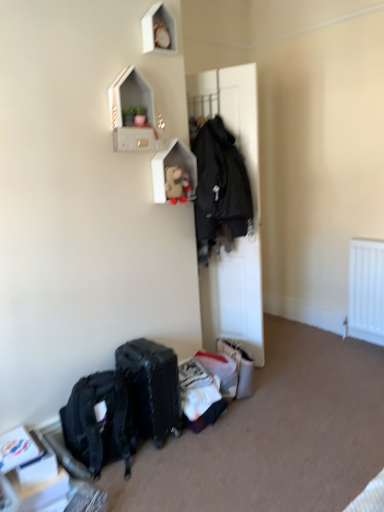
The image size is (384, 512). Describe the element at coordinates (152, 387) in the screenshot. I see `matte black suitcase at lower center` at that location.

You are a GUI agent. You are given a task and a screenshot of the screen. Output one action in this format:
    pyautogui.click(x=<x>, y=<y>)
    Task: Click on the wooden shelf at upper center, marked as the second shelf in a front-to-back arrangement
    This screenshot has height=512, width=384.
    Given the screenshot: What is the action you would take?
    pyautogui.click(x=172, y=164)

Describe the element at coordinates (172, 164) in the screenshot. The image size is (384, 512). I see `wooden shelf at upper center, arranged as the first shelf when viewed from the back` at that location.

What do you see at coordinates (132, 114) in the screenshot?
I see `concrete textured shelf at upper center, placed as the 2th shelf when sorted from back to front` at bounding box center [132, 114].

In order to click on matte black backpack at lower left in this screenshot , I will do `click(100, 422)`.

Can you confirm if matte black backpack at lower left is wider than matte black suitcase at lower center?

Indeed, matte black backpack at lower left has a greater width compared to matte black suitcase at lower center.

From a real-world perspective, is matte black backpack at lower left on top of matte black suitcase at lower center?

No.

Considering the positions of objects matte black backpack at lower left and matte black suitcase at lower center in the image provided, who is behind, matte black backpack at lower left or matte black suitcase at lower center?

matte black suitcase at lower center is behind.

Consider the image. Can you confirm if matte black backpack at lower left is shorter than matte black suitcase at lower center?

Yes.

Which is correct: matte black suitcase at lower center is inside matte black backpack at lower left, or outside of it?

matte black suitcase at lower center is located beyond the bounds of matte black backpack at lower left.

From the image's perspective, which is above, matte black suitcase at lower center or matte black backpack at lower left?

From the image's view, matte black suitcase at lower center is above.

Based on their sizes in the image, would you say matte black suitcase at lower center is bigger or smaller than matte black backpack at lower left?

matte black suitcase at lower center is smaller than matte black backpack at lower left.

Is matte black suitcase at lower center further to the viewer compared to matte black backpack at lower left?

Yes, matte black suitcase at lower center is behind matte black backpack at lower left.

Who is smaller, wooden shelf at upper center, marked as the second shelf in a front-to-back arrangement, or concrete textured shelf at upper center, which is the first shelf from front to back?

wooden shelf at upper center, marked as the second shelf in a front-to-back arrangement.

In order to click on shelf in front of the wooden shelf at upper center, arranged as the first shelf when viewed from the back in this screenshot , I will do [x=132, y=114].

Could you tell me if wooden shelf at upper center, marked as the second shelf in a front-to-back arrangement, is turned towards concrete textured shelf at upper center, placed as the 2th shelf when sorted from back to front?

No, wooden shelf at upper center, marked as the second shelf in a front-to-back arrangement, is not facing towards concrete textured shelf at upper center, placed as the 2th shelf when sorted from back to front.

Considering the positions of objects wooden shelf at upper center, marked as the second shelf in a front-to-back arrangement, and fuzzy fabric teddy bear at upper center in the image provided, who is more to the right, wooden shelf at upper center, marked as the second shelf in a front-to-back arrangement, or fuzzy fabric teddy bear at upper center?

Positioned to the right is fuzzy fabric teddy bear at upper center.

Are wooden shelf at upper center, arranged as the first shelf when viewed from the back, and fuzzy fabric teddy bear at upper center making contact?

Yes.

How far apart are wooden shelf at upper center, marked as the second shelf in a front-to-back arrangement, and fuzzy fabric teddy bear at upper center?

A distance of 7.72 centimeters exists between wooden shelf at upper center, marked as the second shelf in a front-to-back arrangement, and fuzzy fabric teddy bear at upper center.

Is wooden shelf at upper center, arranged as the first shelf when viewed from the back, not inside fuzzy fabric teddy bear at upper center?

Indeed, wooden shelf at upper center, arranged as the first shelf when viewed from the back, is completely outside fuzzy fabric teddy bear at upper center.

Can matte black suitcase at lower center be found inside wooden shelf at upper center, marked as the second shelf in a front-to-back arrangement?

No, matte black suitcase at lower center is not surrounded by wooden shelf at upper center, marked as the second shelf in a front-to-back arrangement.

Is point (165, 200) in front of point (137, 416)?

No, it is not.

Where is `shelf behind the matte black suitcase at lower center`? Image resolution: width=384 pixels, height=512 pixels. shelf behind the matte black suitcase at lower center is located at coordinates (172, 164).

Between wooden shelf at upper center, marked as the second shelf in a front-to-back arrangement, and matte black suitcase at lower center, which one has larger width?

With larger width is matte black suitcase at lower center.

You are a GUI agent. You are given a task and a screenshot of the screen. Output one action in this format:
    pyautogui.click(x=<x>, y=<y>)
    Task: Click on the shelf in front of the wooden shelf at upper center, marked as the second shelf in a front-to-back arrangement
    This screenshot has width=384, height=512.
    Given the screenshot: What is the action you would take?
    pyautogui.click(x=132, y=114)

Can you tell me how much concrete textured shelf at upper center, which is the first shelf from front to back, and wooden shelf at upper center, arranged as the first shelf when viewed from the back, differ in facing direction?

The angular difference between concrete textured shelf at upper center, which is the first shelf from front to back, and wooden shelf at upper center, arranged as the first shelf when viewed from the back, is 0.0997 degrees.

Are concrete textured shelf at upper center, which is the first shelf from front to back, and wooden shelf at upper center, marked as the second shelf in a front-to-back arrangement, far apart?

Actually, concrete textured shelf at upper center, which is the first shelf from front to back, and wooden shelf at upper center, marked as the second shelf in a front-to-back arrangement, are a little close together.

Can you confirm if fuzzy fabric teddy bear at upper center is thinner than wooden shelf at upper center, arranged as the first shelf when viewed from the back?

No.

Considering the sizes of objects fuzzy fabric teddy bear at upper center and wooden shelf at upper center, arranged as the first shelf when viewed from the back, in the image provided, who is shorter, fuzzy fabric teddy bear at upper center or wooden shelf at upper center, arranged as the first shelf when viewed from the back,?

With less height is fuzzy fabric teddy bear at upper center.

From the image's perspective, does fuzzy fabric teddy bear at upper center appear higher than wooden shelf at upper center, marked as the second shelf in a front-to-back arrangement?

No.

Considering the relative positions of fuzzy fabric teddy bear at upper center and wooden shelf at upper center, marked as the second shelf in a front-to-back arrangement, in the image provided, is fuzzy fabric teddy bear at upper center to the left or to the right of wooden shelf at upper center, marked as the second shelf in a front-to-back arrangement,?

fuzzy fabric teddy bear at upper center is positioned on wooden shelf at upper center, marked as the second shelf in a front-to-back arrangement,'s right side.

Locate an element on the screen. This screenshot has height=512, width=384. luggage and bags above the matte black backpack at lower left (from the image's perspective) is located at coordinates (152, 387).

This screenshot has height=512, width=384. I want to click on backpack below the matte black suitcase at lower center (from a real-world perspective), so click(x=100, y=422).

Looking at the image, which one is located closer to matte black suitcase at lower center, concrete textured shelf at upper center, which is the first shelf from front to back, or wooden shelf at upper center, arranged as the first shelf when viewed from the back?

wooden shelf at upper center, arranged as the first shelf when viewed from the back, is positioned closer to the anchor matte black suitcase at lower center.

When comparing their distances from matte black suitcase at lower center, does matte black backpack at lower left or wooden shelf at upper center, marked as the second shelf in a front-to-back arrangement, seem further?

wooden shelf at upper center, marked as the second shelf in a front-to-back arrangement.

From the image, which object appears to be nearer to black matte door at center, matte black suitcase at lower center or concrete textured shelf at upper center, placed as the 2th shelf when sorted from back to front?

concrete textured shelf at upper center, placed as the 2th shelf when sorted from back to front, lies closer to black matte door at center than the other object.

Based on their spatial positions, is concrete textured shelf at upper center, which is the first shelf from front to back, or black matte door at center further from matte black suitcase at lower center?

concrete textured shelf at upper center, which is the first shelf from front to back.

When comparing their distances from matte black suitcase at lower center, does wooden shelf at upper center, marked as the second shelf in a front-to-back arrangement, or concrete textured shelf at upper center, placed as the 2th shelf when sorted from back to front, seem further?

The object further to matte black suitcase at lower center is concrete textured shelf at upper center, placed as the 2th shelf when sorted from back to front.

Estimate the real-world distances between objects in this image. Which object is closer to black matte door at center, concrete textured shelf at upper center, placed as the 2th shelf when sorted from back to front, or matte black backpack at lower left?

Based on the image, concrete textured shelf at upper center, placed as the 2th shelf when sorted from back to front, appears to be nearer to black matte door at center.

Which object lies further to the anchor point matte black backpack at lower left, black matte door at center or concrete textured shelf at upper center, placed as the 2th shelf when sorted from back to front?

concrete textured shelf at upper center, placed as the 2th shelf when sorted from back to front, lies further to matte black backpack at lower left than the other object.

Looking at the image, which one is located closer to concrete textured shelf at upper center, placed as the 2th shelf when sorted from back to front, black matte door at center or wooden shelf at upper center, marked as the second shelf in a front-to-back arrangement?

The object closer to concrete textured shelf at upper center, placed as the 2th shelf when sorted from back to front, is wooden shelf at upper center, marked as the second shelf in a front-to-back arrangement.

Identify the location of luggage and bags that lies between black matte door at center and matte black backpack at lower left from top to bottom. This screenshot has height=512, width=384. (152, 387).

The width and height of the screenshot is (384, 512). Find the location of `toy situated between wooden shelf at upper center, marked as the second shelf in a front-to-back arrangement, and black matte door at center from left to right`. toy situated between wooden shelf at upper center, marked as the second shelf in a front-to-back arrangement, and black matte door at center from left to right is located at coordinates (177, 185).

This screenshot has height=512, width=384. What are the coordinates of `luggage and bags between wooden shelf at upper center, arranged as the first shelf when viewed from the back, and matte black backpack at lower left, in the vertical direction` in the screenshot? It's located at (152, 387).

At what (x,y) coordinates should I click in order to perform the action: click on door between fuzzy fabric teddy bear at upper center and matte black suitcase at lower center from top to bottom. Please return your answer as a coordinate pair (x, y). Looking at the image, I should click on (254, 215).